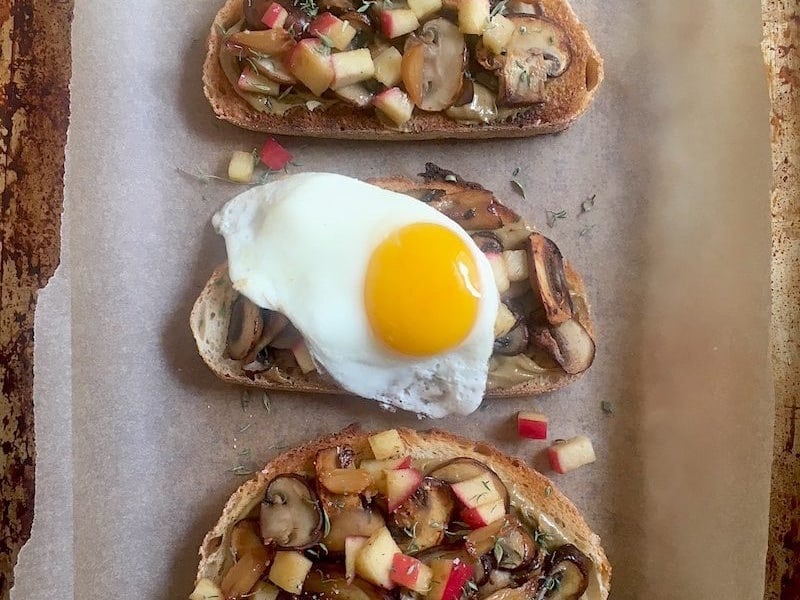
You are a GUI agent. You are given a task and a screenshot of the screen. Output one action in this format:
    pyautogui.click(x=<x>, y=<y>)
    Task: Click on the baking paper
    
    Given the screenshot: What is the action you would take?
    652,253